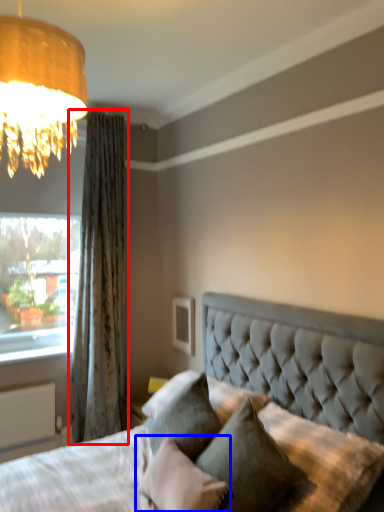
Question: Which of the following is the farthest to the observer, curtain (highlighted by a red box) or pillow (highlighted by a blue box)?

Choices:
 (A) curtain
 (B) pillow

Answer: (A)